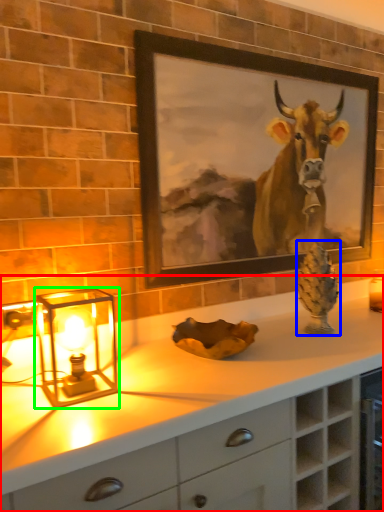
Question: Based on their relative distances, which object is farther from countertop (highlighted by a red box)? Choose from pine cone (highlighted by a blue box) and table lamp (highlighted by a green box).

Choices:
 (A) pine cone
 (B) table lamp

Answer: (A)